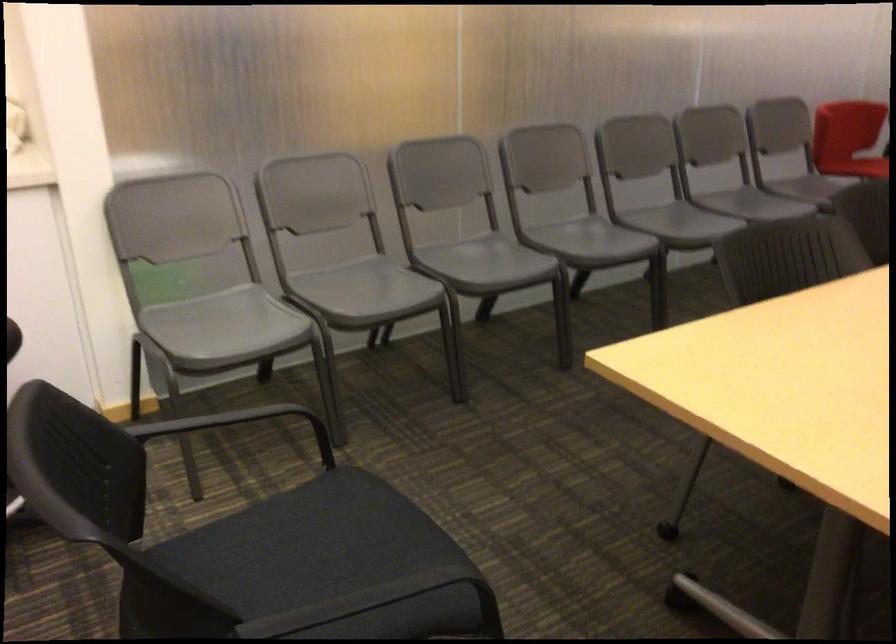
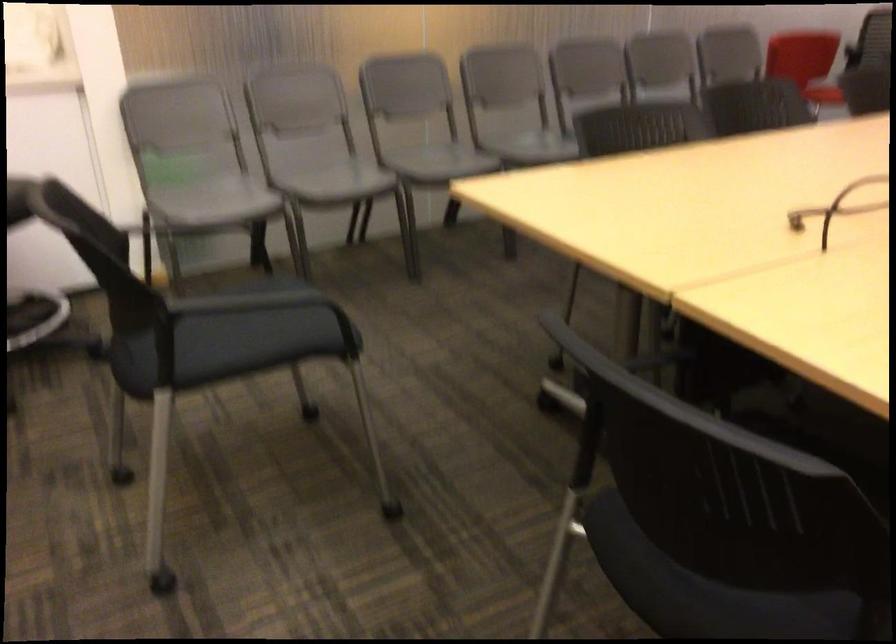
Question: The images are taken continuously from a first-person perspective. In which direction is your viewpoint rotating?

Choices:
 (A) Left
 (B) Right
 (C) Up
 (D) Down

Answer: (D)